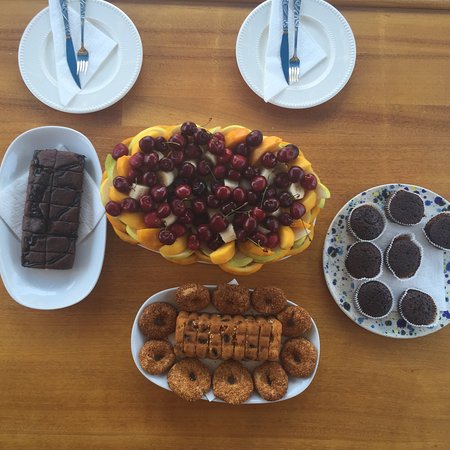
Locate an element on the screen. This screenshot has height=450, width=450. table is located at coordinates (74, 383), (389, 131).